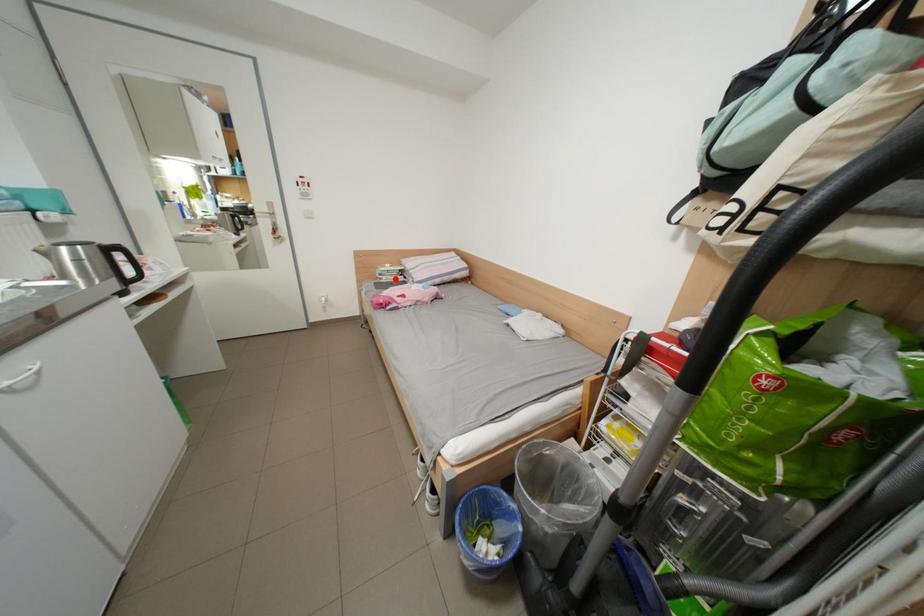
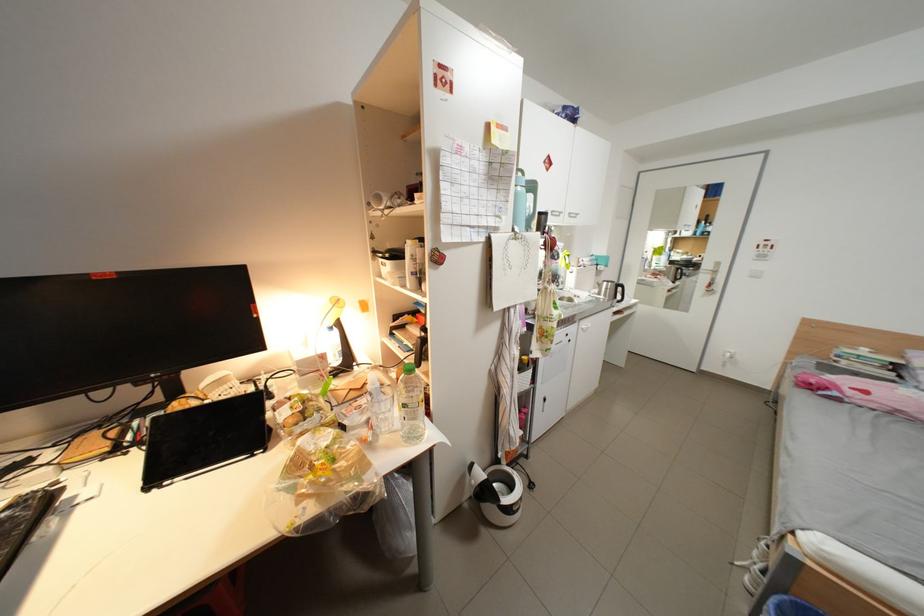
Question: I am providing you with two images of the same scene from different viewpoints. A red point is shown in image1. For the corresponding object point in image2, is it positioned nearer or farther from the camera?

Choices:
 (A) Nearer
 (B) Farther

Answer: (B)